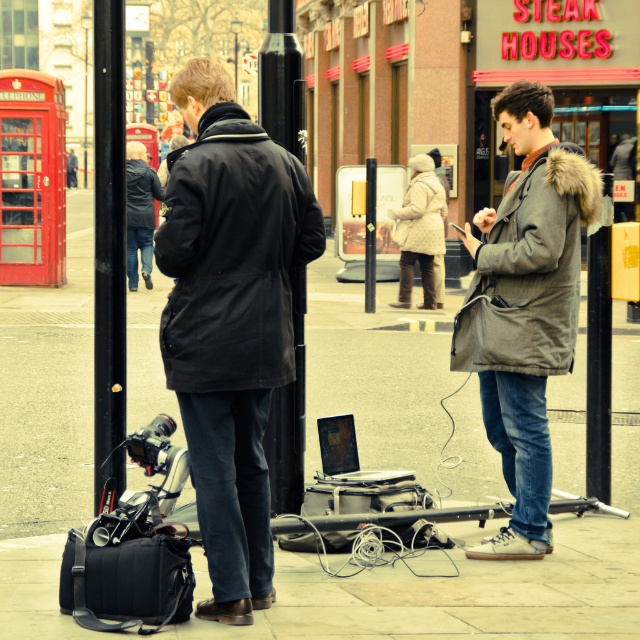
Is gray fur-lined coat at right smaller than silver metallic laptop at center?

No.

Does gray fur-lined coat at right appear on the right side of silver metallic laptop at center?

Correct, you'll find gray fur-lined coat at right to the right of silver metallic laptop at center.

Between point (484, 429) and point (326, 428), which one is positioned in front?

Point (484, 429) is more forward.

Locate an element on the screen. Image resolution: width=640 pixels, height=640 pixels. gray fur-lined coat at right is located at coordinates (525, 307).

Who is shorter, dark matte coat at center or black metal pole at center?

Standing shorter between the two is dark matte coat at center.

The image size is (640, 640). What do you see at coordinates (230, 321) in the screenshot? I see `dark matte coat at center` at bounding box center [230, 321].

Is point (180, 288) positioned before point (118, 216)?

Yes, it is.

Where is `dark matte coat at center`? The width and height of the screenshot is (640, 640). dark matte coat at center is located at coordinates (230, 321).

Can you confirm if dark matte coat at center is positioned to the right of black smooth pole at center?

No, dark matte coat at center is not to the right of black smooth pole at center.

Is dark matte coat at center thinner than black smooth pole at center?

No, dark matte coat at center is not thinner than black smooth pole at center.

Describe the element at coordinates (230, 321) in the screenshot. This screenshot has height=640, width=640. I see `dark matte coat at center` at that location.

You are a GUI agent. You are given a task and a screenshot of the screen. Output one action in this format:
    pyautogui.click(x=<x>, y=<y>)
    Task: Click on the dark matte coat at center
    This screenshot has height=640, width=640.
    Given the screenshot: What is the action you would take?
    pyautogui.click(x=230, y=321)